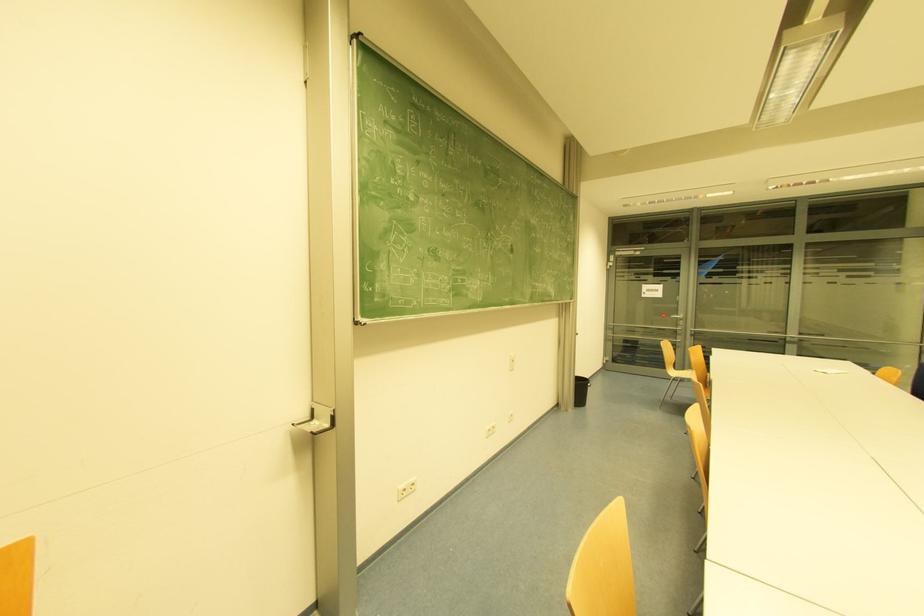
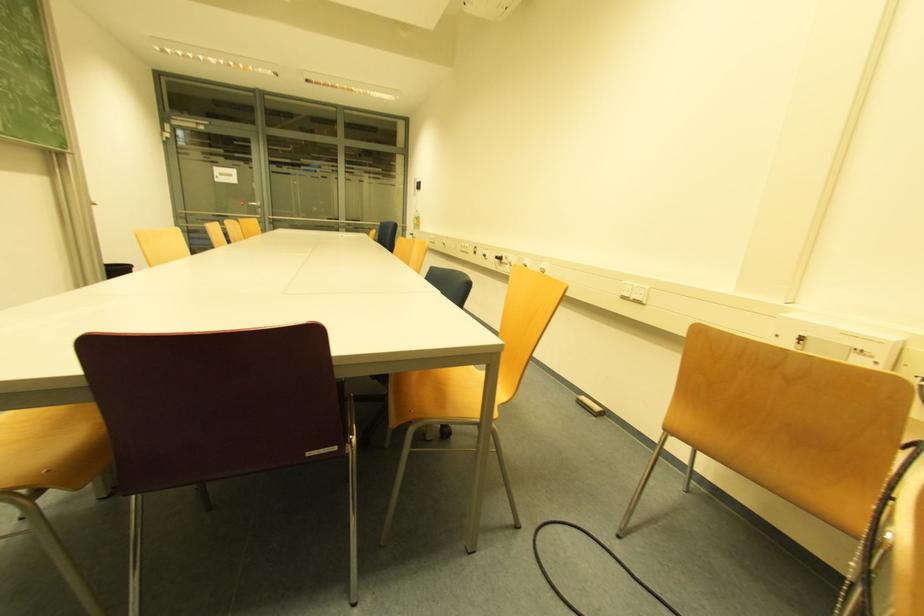
Question: The camera is either moving clockwise (left) or counter-clockwise (right) around the object. The first image is from the beginning of the video and the second image is from the end. Is the camera moving left or right when shooting the video?

Choices:
 (A) Left
 (B) Right

Answer: (A)